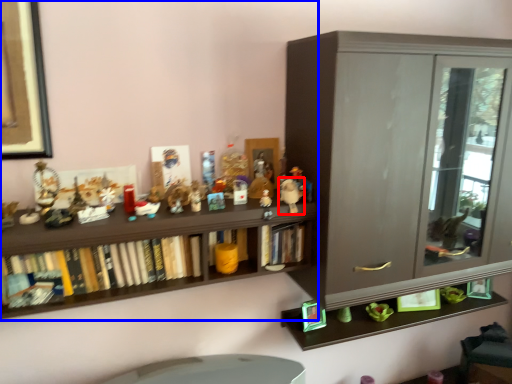
Question: Which of the following is the farthest to the observer, toy (highlighted by a red box) or shelf (highlighted by a blue box)?

Choices:
 (A) toy
 (B) shelf

Answer: (A)